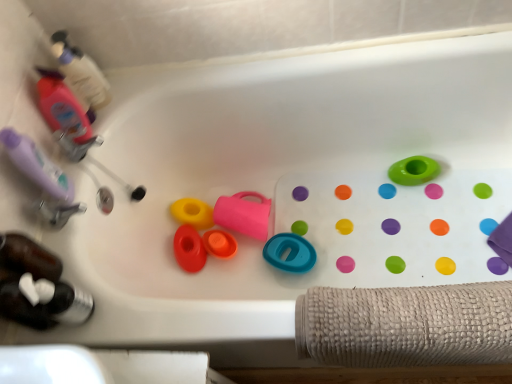
This screenshot has height=384, width=512. In order to click on vacant point to the right of translucent plastic bottle at upper left, placed as the 3th bottle when sorted from bottom to top in this screenshot , I will do `click(147, 87)`.